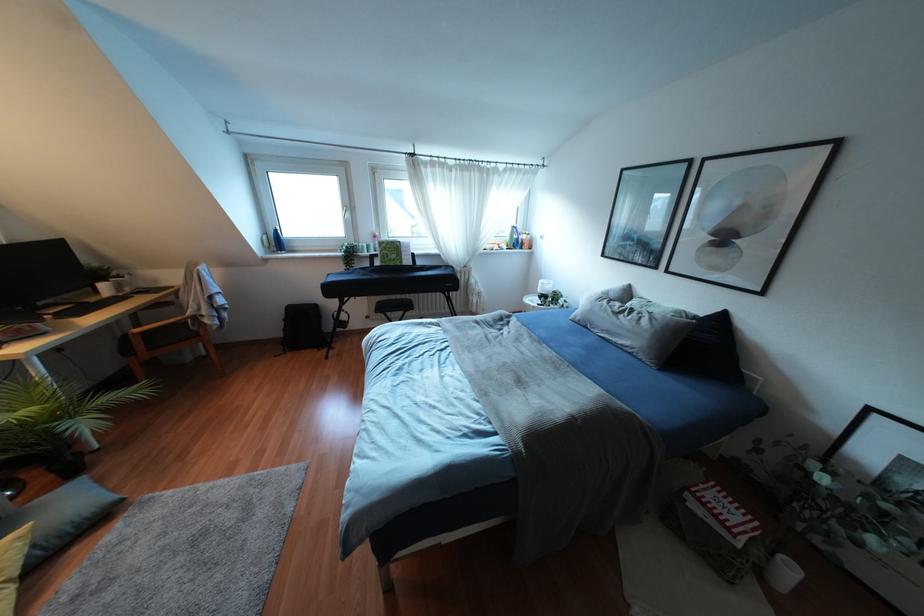
Locate an element on the screen. black backpack is located at coordinates (301, 328).